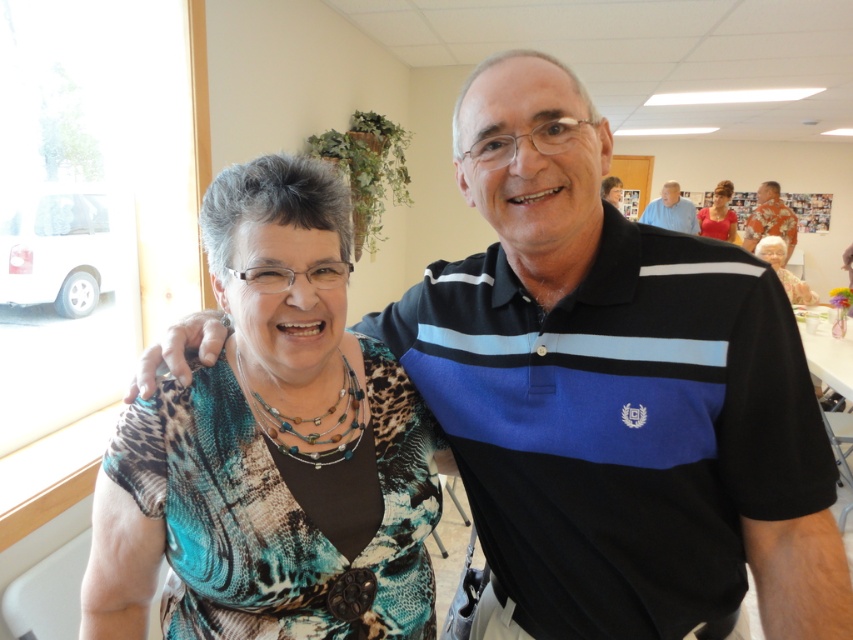
Question: Which object is the farthest from the multicolored fabric blouse at left?

Choices:
 (A) blue striped polo shirt at upper right
 (B) black striped polo shirt at center
 (C) hawaiian shirt at upper right

Answer: (A)

Question: Is multicolored fabric blouse at left above matte black hair at upper right?

Choices:
 (A) no
 (B) yes

Answer: (A)

Question: Which of the following is the farthest from the observer?

Choices:
 (A) blue striped polo shirt at upper right
 (B) matte red blouse at upper right
 (C) matte black hair at upper right
 (D) hawaiian shirt at upper right

Answer: (B)

Question: Which point is farther from the camera taking this photo?

Choices:
 (A) (747, 220)
 (B) (672, 221)
 (C) (260, 461)
 (D) (801, 289)

Answer: (A)

Question: In this image, where is hawaiian shirt at upper right located relative to matte black hair at upper right?

Choices:
 (A) below
 (B) above

Answer: (B)

Question: Can you confirm if black striped polo shirt at center is positioned to the left of hawaiian shirt at upper right?

Choices:
 (A) yes
 (B) no

Answer: (A)